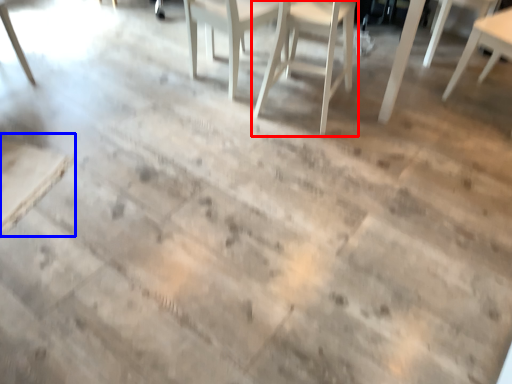
Question: Which object is closer to the camera taking this photo, chair (highlighted by a red box) or table (highlighted by a blue box)?

Choices:
 (A) chair
 (B) table

Answer: (B)